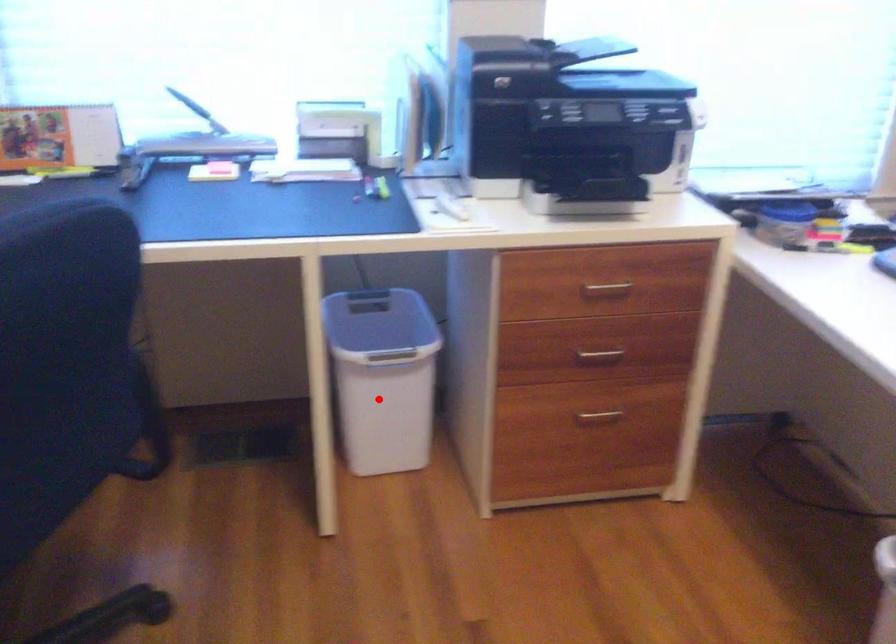
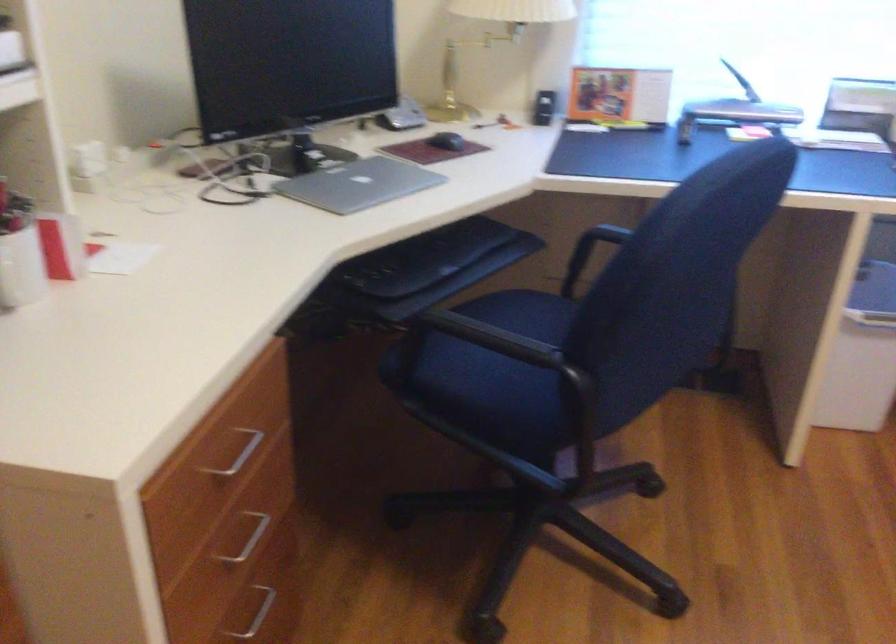
Find the pixel in the second image that matches the highlighted location in the first image.

(862, 355)